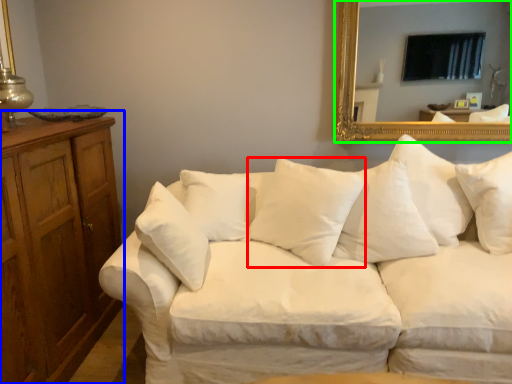
Question: Which object is positioned closest to pillow (highlighted by a red box)? Select from dresser (highlighted by a blue box) and mirror (highlighted by a green box).

Choices:
 (A) dresser
 (B) mirror

Answer: (B)